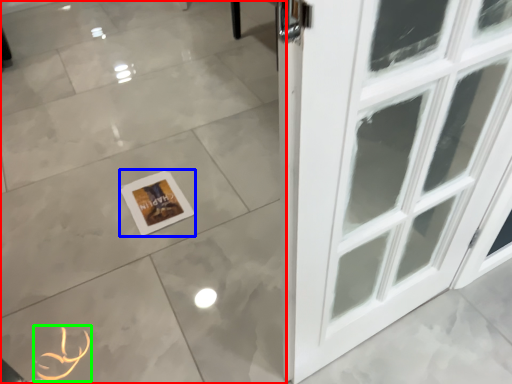
Question: Which is farther away from ceramic tile (highlighted by a red box)? picture frame (highlighted by a blue box) or print (highlighted by a green box)?

Choices:
 (A) picture frame
 (B) print

Answer: (B)